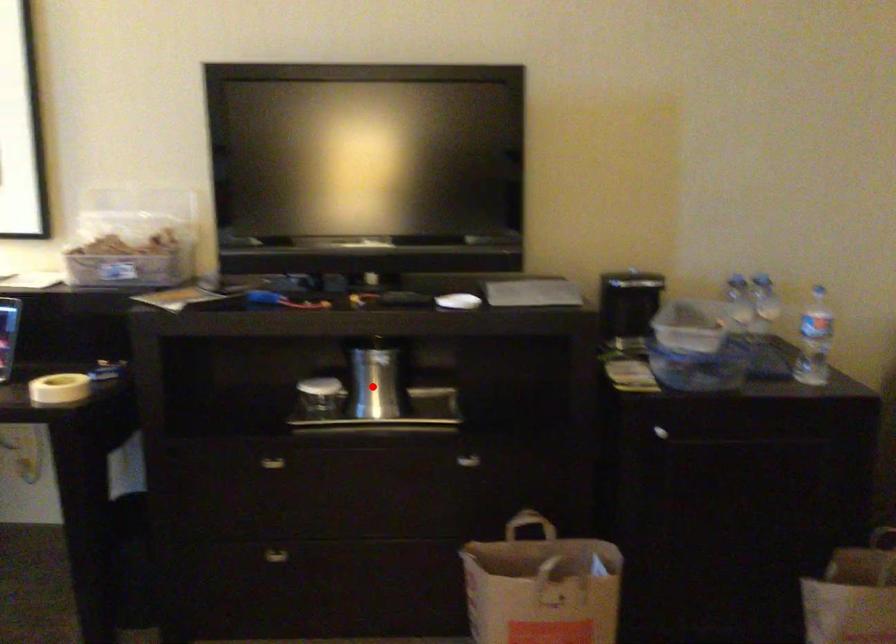
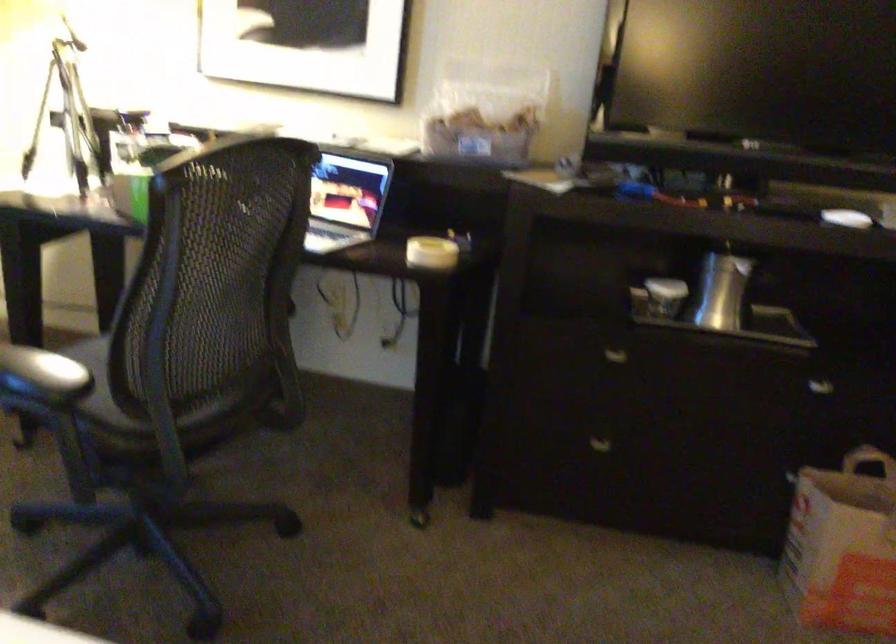
Where in the second image is the point corresponding to the highlighted location from the first image?

(721, 290)